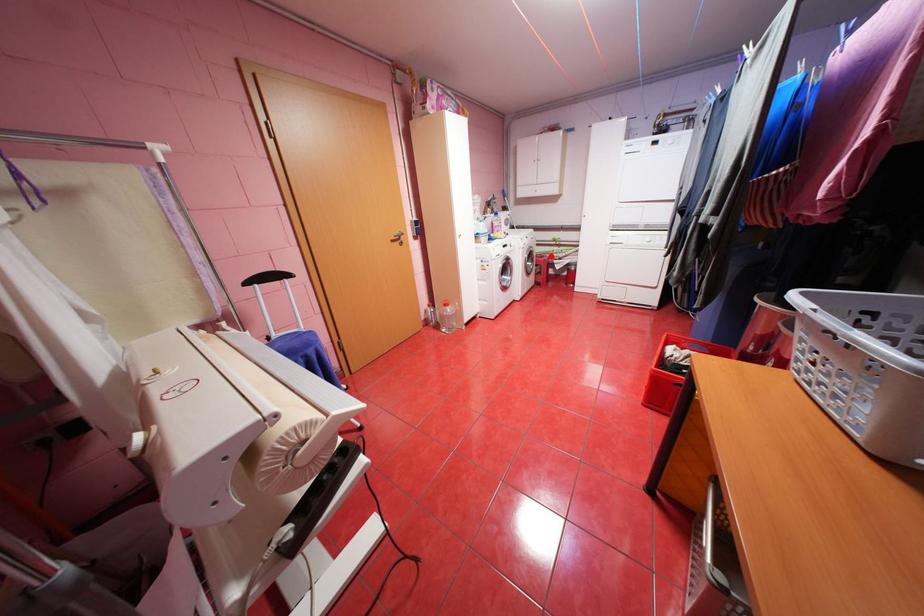
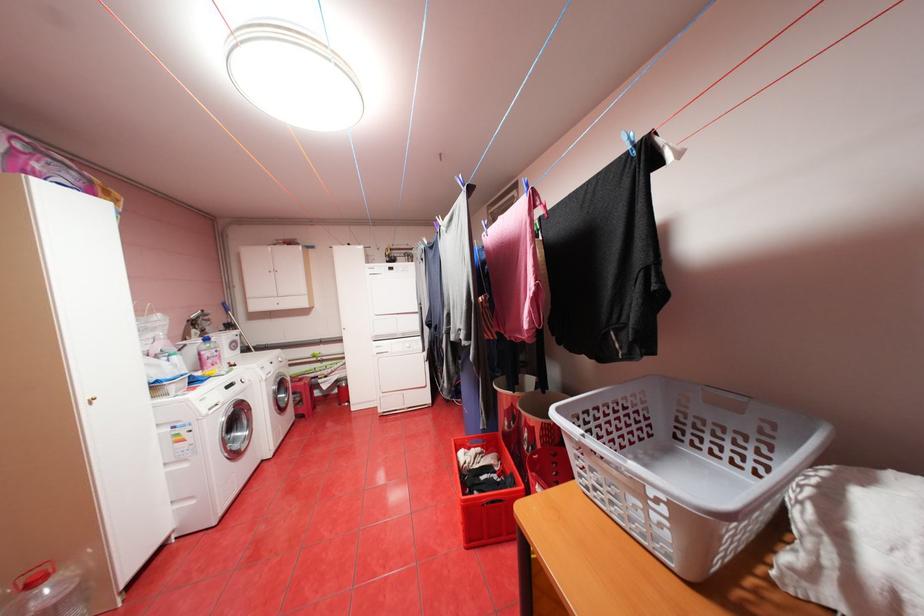
Locate, in the second image, the point that corresponds to the highlighted location in the first image.

(310, 379)